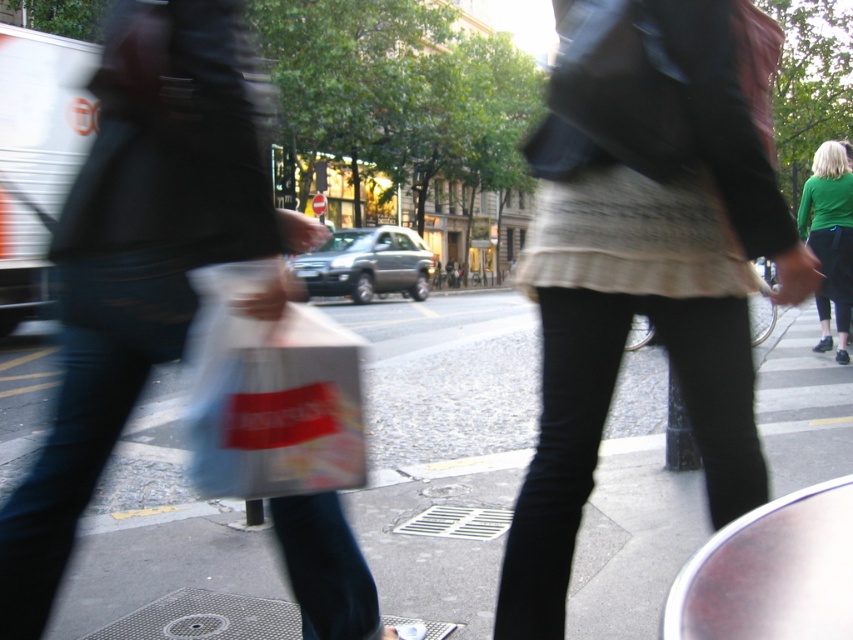
Does matte plastic bag at center appear under translucent plastic bag at center?

No, matte plastic bag at center is not below translucent plastic bag at center.

Is point (86, 308) farther from viewer compared to point (218, 404)?

Yes, point (86, 308) is behind point (218, 404).

This screenshot has height=640, width=853. In order to click on matte plastic bag at center in this screenshot , I will do `click(138, 260)`.

Is point (558, 538) positioned before point (73, 492)?

Yes, point (558, 538) is closer to viewer.

Does knit sweater at center come behind matte plastic bag at center?

That is True.

Who is more distant from viewer, (790, 268) or (117, 291)?

The point (790, 268) is more distant.

The image size is (853, 640). In order to click on knit sweater at center in this screenshot , I will do `click(643, 260)`.

Does smooth asphalt at center appear on the right side of green fabric jacket at upper right?

Incorrect, smooth asphalt at center is not on the right side of green fabric jacket at upper right.

Is smooth asphalt at center smaller than green fabric jacket at upper right?

No.

Is point (598, 628) closer to viewer compared to point (834, 225)?

Yes, point (598, 628) is in front of point (834, 225).

At what (x,y) coordinates should I click in order to perform the action: click on smooth asphalt at center. Please return your answer as a coordinate pair (x, y). The image size is (853, 640). Looking at the image, I should click on (444, 444).